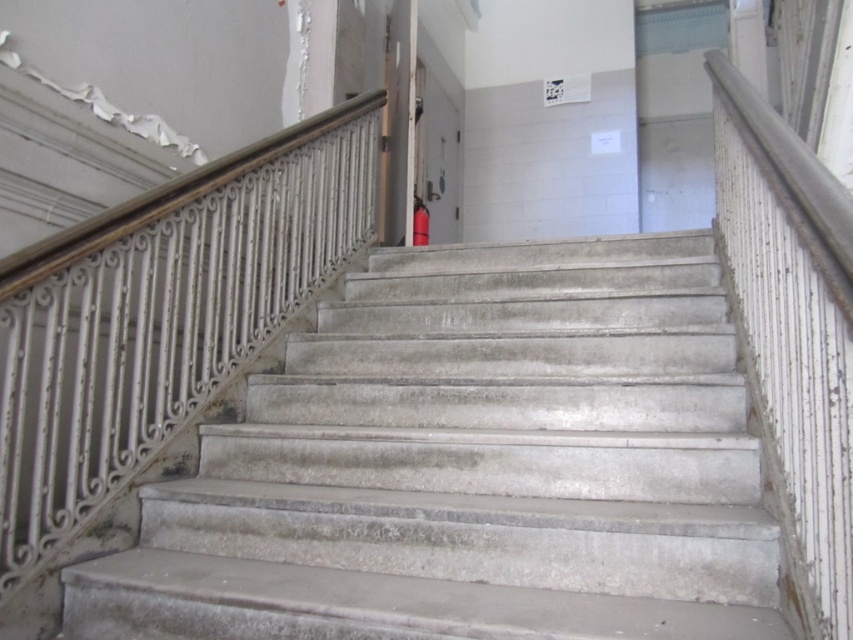
Question: Which of the following is the closest to the observer?

Choices:
 (A) concrete stairs at center
 (B) white wrought iron at upper left

Answer: (A)

Question: Does concrete stairs at center have a lesser width compared to white wrought iron at upper left?

Choices:
 (A) no
 (B) yes

Answer: (A)

Question: Does concrete stairs at center have a larger size compared to white wrought iron at upper left?

Choices:
 (A) no
 (B) yes

Answer: (A)

Question: Does concrete stairs at center come in front of white wrought iron at upper left?

Choices:
 (A) yes
 (B) no

Answer: (A)